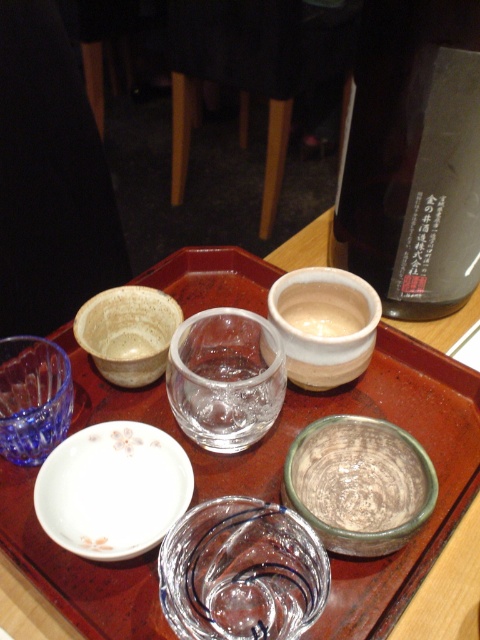
Between point (210, 502) and point (109, 321), which one is positioned in front?

Point (210, 502)

Based on the photo, can you confirm if transparent glass bowl at center is shorter than matte ceramic bowl at upper left?

Yes.

Where is `transparent glass bowl at center`? transparent glass bowl at center is located at coordinates (241, 572).

In order to click on transparent glass bowl at center in this screenshot , I will do `click(241, 572)`.

Is green glazed bowl at lower center above matte ceramic bowl at upper left?

No.

Is point (289, 502) less distant than point (179, 308)?

Yes, point (289, 502) is in front of point (179, 308).

Describe the element at coordinates (359, 483) in the screenshot. I see `green glazed bowl at lower center` at that location.

Identify the location of green glazed bowl at lower center. The height and width of the screenshot is (640, 480). (359, 483).

Which is behind, point (143, 577) or point (107, 435)?

Point (107, 435)

Can you confirm if transparent glass tray at center is bigger than white porcelain plate at center?

Yes, transparent glass tray at center is bigger than white porcelain plate at center.

Which is in front, point (404, 387) or point (79, 454)?

Point (79, 454) is more forward.

Find the location of a particular element. Image resolution: width=480 pixels, height=640 pixels. transparent glass tray at center is located at coordinates (315, 419).